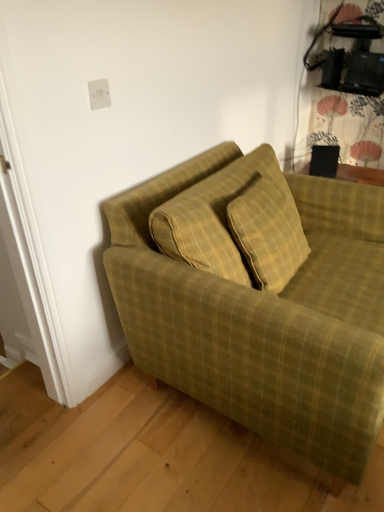
What is the approximate width of white plastic outlet at upper center?

It is 0.72 inches.

What do you see at coordinates (99, 94) in the screenshot? This screenshot has height=512, width=384. I see `white plastic outlet at upper center` at bounding box center [99, 94].

I want to click on white plastic outlet at upper center, so click(x=99, y=94).

Measure the distance between point (93,97) and camera.

The depth of point (93,97) is 4.43 feet.

You are a GUI agent. You are given a task and a screenshot of the screen. Output one action in this format:
    pyautogui.click(x=<x>, y=<y>)
    Task: Click on the green plaid fabric couch at lower right
    The height and width of the screenshot is (512, 384).
    Given the screenshot: What is the action you would take?
    pyautogui.click(x=259, y=298)

What is the approximate height of green plaid fabric couch at lower right?

32.36 inches.

What do you see at coordinates (259, 298) in the screenshot?
I see `green plaid fabric couch at lower right` at bounding box center [259, 298].

I want to click on white plastic outlet at upper center, so click(x=99, y=94).

Is white plastic outlet at upper center at the left side of green plaid fabric couch at lower right?

Yes.

Is white plastic outlet at upper center positioned in front of green plaid fabric couch at lower right?

That is False.

Is point (103, 82) positioned before point (287, 342)?

That is False.

From the image's perspective, which is below, white plastic outlet at upper center or green plaid fabric couch at lower right?

green plaid fabric couch at lower right, from the image's perspective.

From a real-world perspective, is white plastic outlet at upper center below green plaid fabric couch at lower right?

No.

Which of these two, white plastic outlet at upper center or green plaid fabric couch at lower right, is wider?

Wider between the two is green plaid fabric couch at lower right.

In terms of height, does white plastic outlet at upper center look taller or shorter compared to green plaid fabric couch at lower right?

Considering their sizes, white plastic outlet at upper center has less height than green plaid fabric couch at lower right.

Is white plastic outlet at upper center bigger or smaller than green plaid fabric couch at lower right?

Considering their sizes, white plastic outlet at upper center takes up less space than green plaid fabric couch at lower right.

Is white plastic outlet at upper center surrounding green plaid fabric couch at lower right?

Actually, green plaid fabric couch at lower right is outside white plastic outlet at upper center.

Is white plastic outlet at upper center next to green plaid fabric couch at lower right?

No, white plastic outlet at upper center is not making contact with green plaid fabric couch at lower right.

Is white plastic outlet at upper center aimed at green plaid fabric couch at lower right?

No, white plastic outlet at upper center is not aimed at green plaid fabric couch at lower right.

The image size is (384, 512). Find the location of `studio couch below the white plastic outlet at upper center (from the image's perspective)`. studio couch below the white plastic outlet at upper center (from the image's perspective) is located at coordinates click(259, 298).

Considering the positions of objects green plaid fabric couch at lower right and white plastic outlet at upper center in the image provided, who is more to the right, green plaid fabric couch at lower right or white plastic outlet at upper center?

From the viewer's perspective, green plaid fabric couch at lower right appears more on the right side.

Relative to white plastic outlet at upper center, is green plaid fabric couch at lower right in front or behind?

green plaid fabric couch at lower right is positioned closer to the viewer than white plastic outlet at upper center.

Is point (157, 295) closer to viewer compared to point (103, 82)?

No, (157, 295) is behind (103, 82).

From the image's perspective, between green plaid fabric couch at lower right and white plastic outlet at upper center, who is located below?

green plaid fabric couch at lower right, from the image's perspective.

From a real-world perspective, between green plaid fabric couch at lower right and white plastic outlet at upper center, who is vertically lower?

From a 3D spatial view, green plaid fabric couch at lower right is below.

Can you confirm if green plaid fabric couch at lower right is wider than white plastic outlet at upper center?

Yes.

Is green plaid fabric couch at lower right taller than white plastic outlet at upper center?

Correct, green plaid fabric couch at lower right is much taller as white plastic outlet at upper center.

From the picture: Is green plaid fabric couch at lower right smaller than white plastic outlet at upper center?

No, green plaid fabric couch at lower right is not smaller than white plastic outlet at upper center.

Is green plaid fabric couch at lower right positioned beyond the bounds of white plastic outlet at upper center?

Absolutely, green plaid fabric couch at lower right is external to white plastic outlet at upper center.

Is green plaid fabric couch at lower right far away from white plastic outlet at upper center?

That's not correct — green plaid fabric couch at lower right is a little close to white plastic outlet at upper center.

Could you tell me if green plaid fabric couch at lower right is turned towards white plastic outlet at upper center?

No, green plaid fabric couch at lower right is not facing towards white plastic outlet at upper center.

Find the location of a particular element. This screenshot has height=512, width=384. electric outlet that appears behind the green plaid fabric couch at lower right is located at coordinates (99, 94).

The width and height of the screenshot is (384, 512). Find the location of `electric outlet on the left side of green plaid fabric couch at lower right`. electric outlet on the left side of green plaid fabric couch at lower right is located at coordinates (99, 94).

Identify the location of electric outlet located above the green plaid fabric couch at lower right (from a real-world perspective). (99, 94).